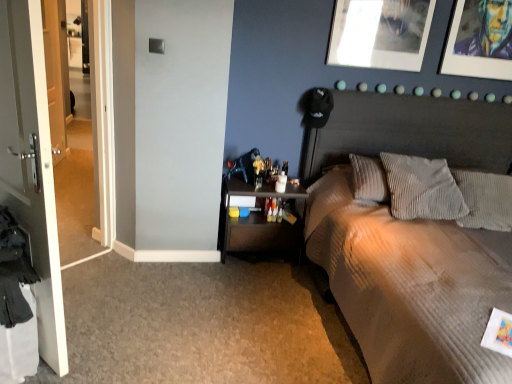
Question: Considering the positions of metallic silver picture frame at upper center, which appears as the first picture frame when viewed from the left, and gray corduroy pillow at right, the 1th pillow from the right, in the image, is metallic silver picture frame at upper center, which appears as the first picture frame when viewed from the left, taller or shorter than gray corduroy pillow at right, the 1th pillow from the right,?

Choices:
 (A) short
 (B) tall

Answer: (B)

Question: Considering the positions of metallic silver picture frame at upper center, which appears as the first picture frame when viewed from the left, and gray corduroy pillow at right, the 1th pillow from the right, in the image, is metallic silver picture frame at upper center, which appears as the first picture frame when viewed from the left, wider or thinner than gray corduroy pillow at right, the 1th pillow from the right,?

Choices:
 (A) thin
 (B) wide

Answer: (A)

Question: Which object is positioned closest to the gray corduroy pillow at right, acting as the second pillow starting from the left?

Choices:
 (A) textured beige bed at upper right
 (B) metallic silver picture frame at upper right, which is the 1th picture frame in right-to-left order
 (C) metallic silver picture frame at upper center, acting as the second picture frame starting from the right
 (D) white glossy door at left
 (E) white corduroy pillow at center, the 2th pillow when ordered from right to left

Answer: (E)

Question: Which of these objects is positioned farthest from the white glossy door at left?

Choices:
 (A) textured beige bed at upper right
 (B) gray corduroy pillow at right, acting as the second pillow starting from the left
 (C) metallic silver picture frame at upper center, acting as the second picture frame starting from the right
 (D) metallic silver picture frame at upper right, which is the second picture frame in left-to-right order
 (E) dark wood nightstand at lower center

Answer: (D)